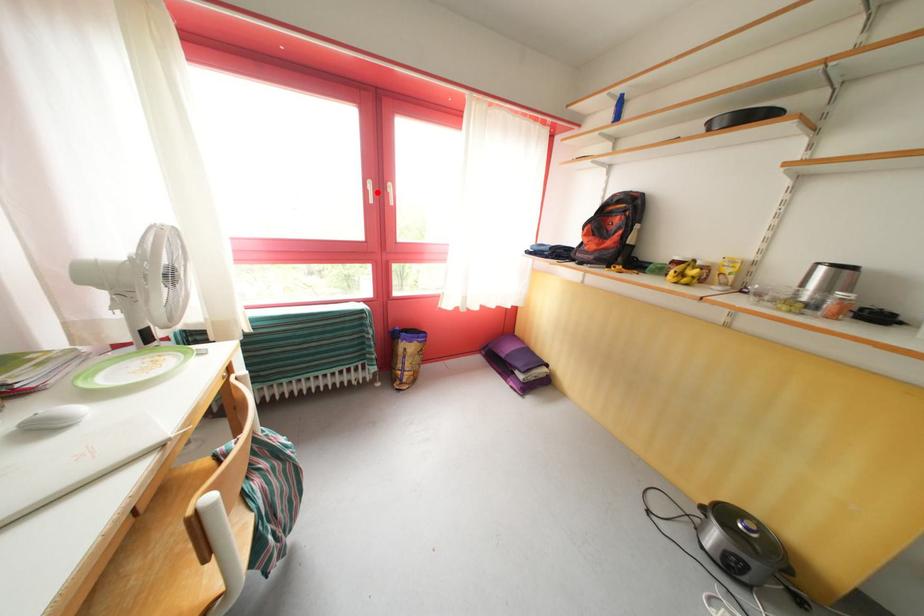
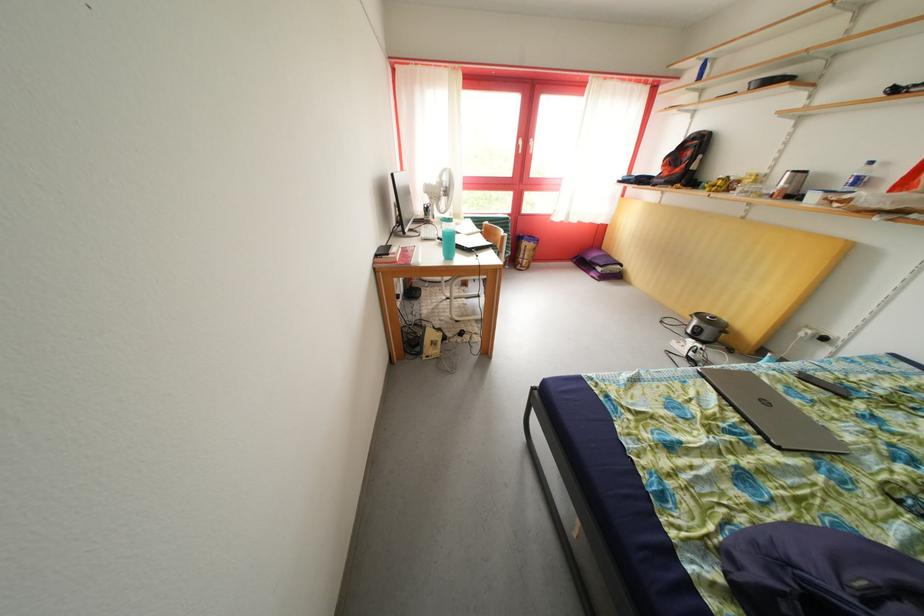
Question: I am providing you with two images of the same scene from different viewpoints. Given a red point in image1, look at the same physical point in image2. Is it:

Choices:
 (A) Closer to the viewpoint
 (B) Farther from the viewpoint

Answer: (A)